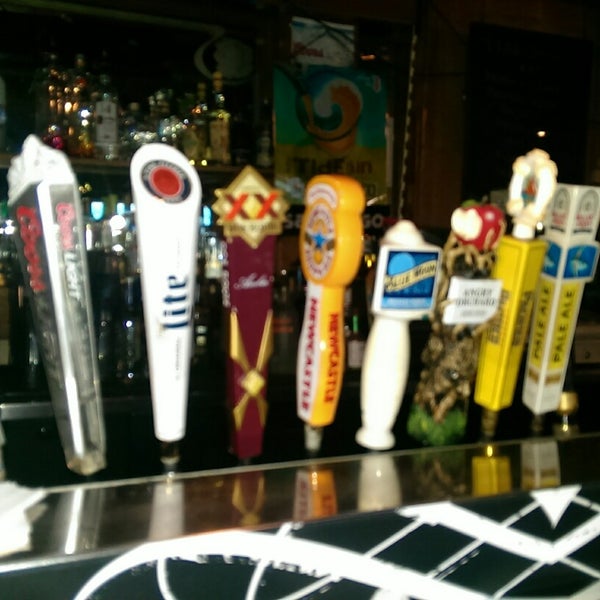
You are a GUI agent. You are given a task and a screenshot of the screen. Output one action in this format:
    pyautogui.click(x=<x>, y=<y>)
    Task: Click on the beer tap handles
    Image resolution: width=600 pixels, height=600 pixels.
    Given the screenshot: What is the action you would take?
    pyautogui.click(x=59, y=337), pyautogui.click(x=166, y=354), pyautogui.click(x=247, y=326), pyautogui.click(x=330, y=338), pyautogui.click(x=385, y=353), pyautogui.click(x=455, y=347), pyautogui.click(x=510, y=335), pyautogui.click(x=549, y=334)